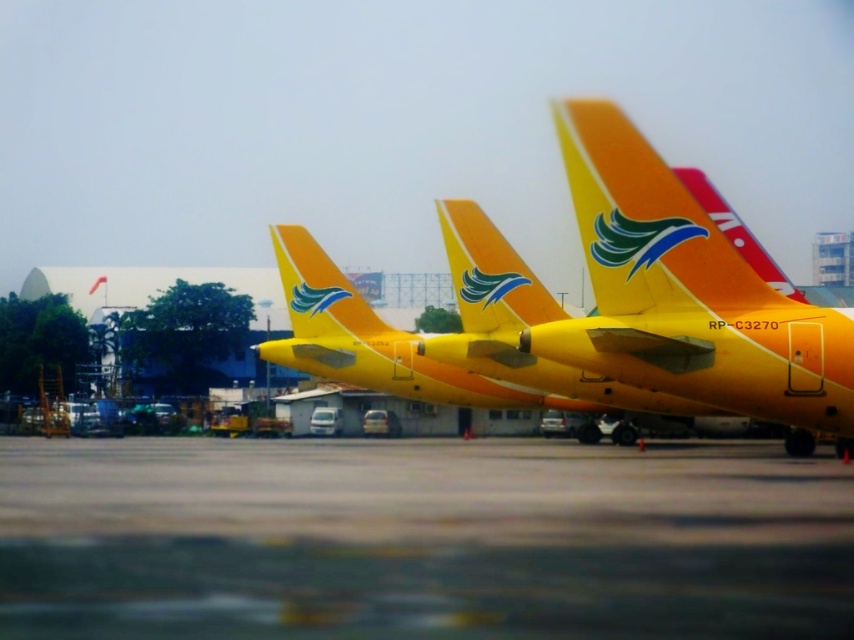
Can you confirm if gray concrete tarmac at lower center is wider than yellow matte airplane at center?

Yes, gray concrete tarmac at lower center is wider than yellow matte airplane at center.

Is gray concrete tarmac at lower center thinner than yellow matte airplane at center?

No, gray concrete tarmac at lower center is not thinner than yellow matte airplane at center.

Between point (294, 586) and point (788, 436), which one is positioned in front?

Positioned in front is point (294, 586).

Identify the location of gray concrete tarmac at lower center. The width and height of the screenshot is (854, 640). (420, 540).